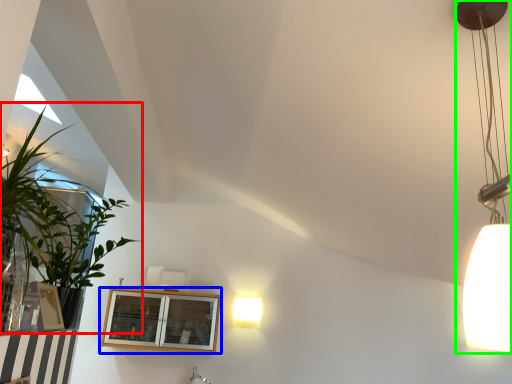
Question: Based on their relative distances, which object is nearer to houseplant (highlighted by a red box)? Choose from window (highlighted by a blue box) and lamp (highlighted by a green box).

Choices:
 (A) window
 (B) lamp

Answer: (B)